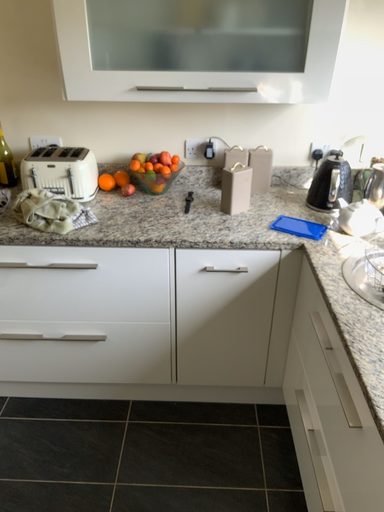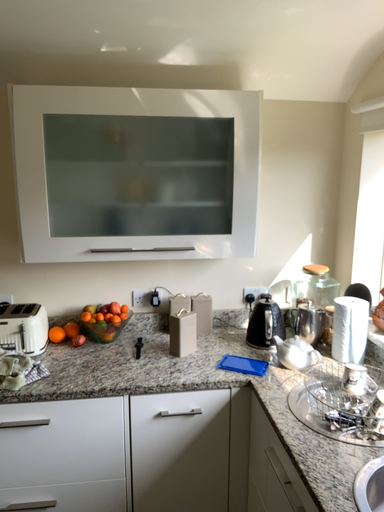
Question: Which way did the camera rotate in the video?

Choices:
 (A) rotated upward
 (B) rotated downward

Answer: (A)